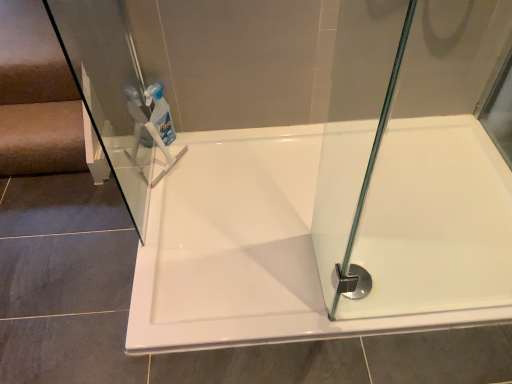
Image resolution: width=512 pixels, height=384 pixels. I want to click on vacant space underneath white glossy bathtub at center (from a real-world perspective), so click(x=356, y=250).